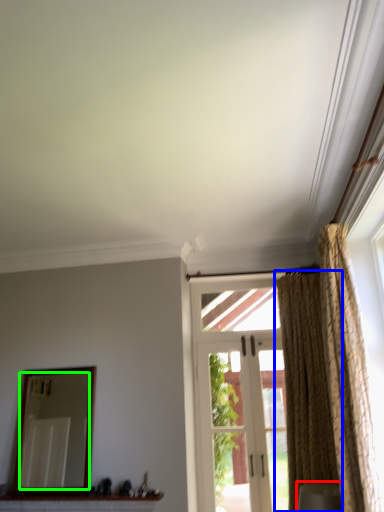
Question: Based on their relative distances, which object is farther from furniture (highlighted by a red box)? Choose from curtain (highlighted by a blue box) and mirror (highlighted by a green box).

Choices:
 (A) curtain
 (B) mirror

Answer: (B)